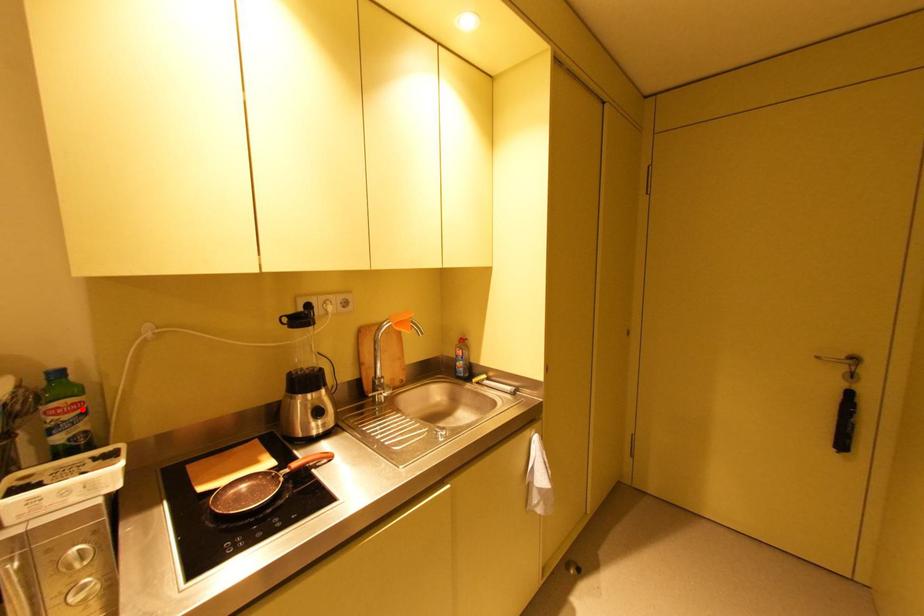
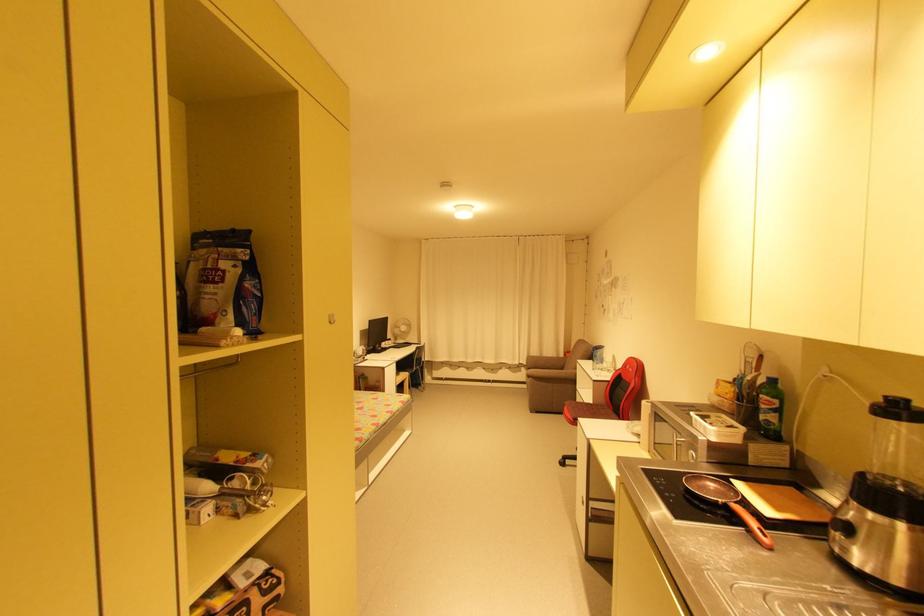
Locate, in the second image, the point that corresponds to the highlighted location in the first image.

(773, 406)